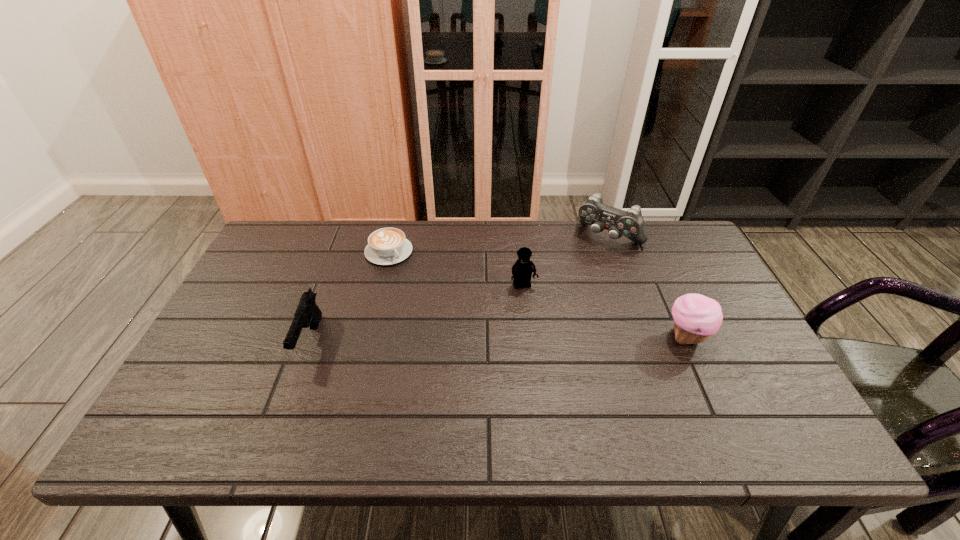
Find the location of a particular element. The image size is (960, 540). free space on the desktop that is between the fourth tallest object and the cupcake and is positioned on the side of the second object from left to right with the handle is located at coordinates (459, 339).

You are a GUI agent. You are given a task and a screenshot of the screen. Output one action in this format:
    pyautogui.click(x=<x>, y=<y>)
    Task: Click on the vacant spot on the desktop that is between the pistol and the cupcake and is positioned on the front-facing side of the third nearest object
    
    Given the screenshot: What is the action you would take?
    pyautogui.click(x=542, y=339)

At what (x,y) coordinates should I click in order to perform the action: click on vacant spot on the desktop that is between the pistol and the cupcake and is positioned on the surface of the control with buttons. Please return your answer as a coordinate pair (x, y). The image size is (960, 540). Looking at the image, I should click on (532, 339).